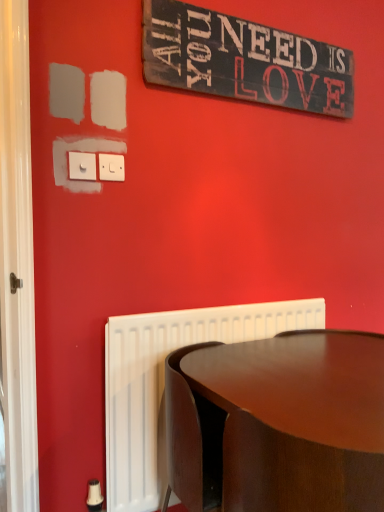
Find the location of a particular element. The width and height of the screenshot is (384, 512). free space above glossy wood table at lower right (from a real-world perspective) is located at coordinates (316, 360).